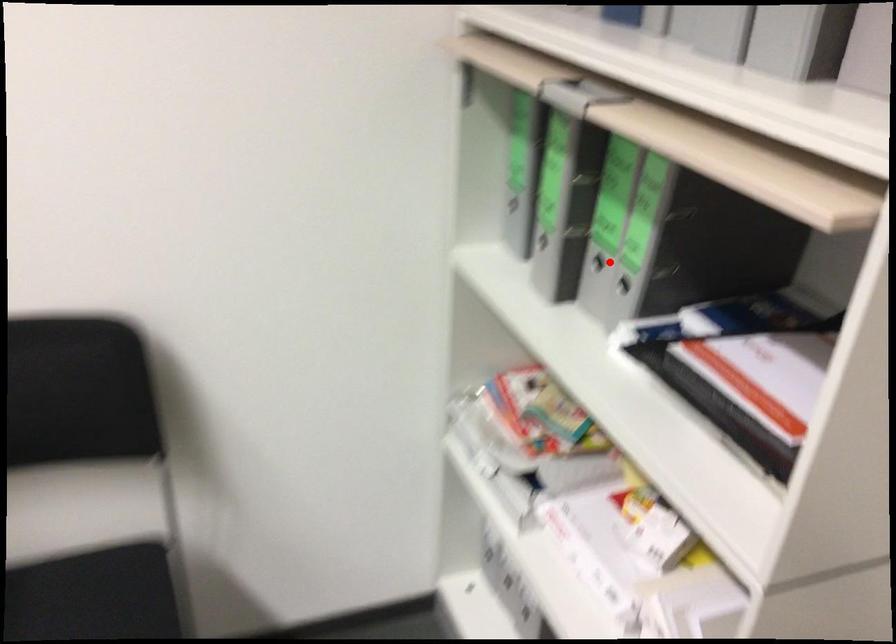
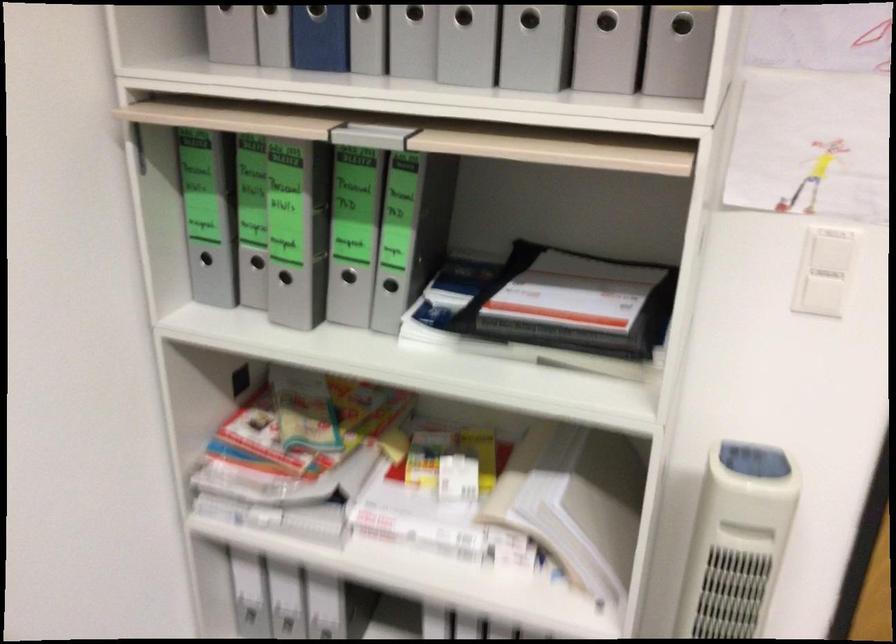
Question: I am providing you with two images of the same scene from different viewpoints. In image1, a red point is highlighted. Considering the same 3D point in image2, which of the following is correct?

Choices:
 (A) It is closer
 (B) It is farther

Answer: (B)